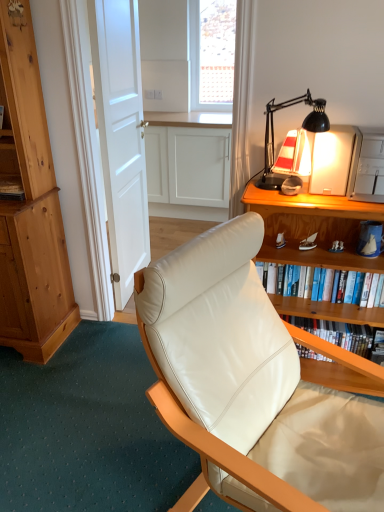
Question: Is white matte door at center completely or partially outside of white leather chair at center?

Choices:
 (A) yes
 (B) no

Answer: (A)

Question: Are white matte door at center and white leather chair at center far apart?

Choices:
 (A) no
 (B) yes

Answer: (B)

Question: Does white matte door at center come in front of white leather chair at center?

Choices:
 (A) no
 (B) yes

Answer: (A)

Question: Is the position of white matte door at center more distant than that of white leather chair at center?

Choices:
 (A) no
 (B) yes

Answer: (B)

Question: Can you confirm if white matte door at center is smaller than white leather chair at center?

Choices:
 (A) no
 (B) yes

Answer: (B)

Question: Does white matte door at center have a greater width compared to white leather chair at center?

Choices:
 (A) no
 (B) yes

Answer: (A)

Question: Can you confirm if black matte desk lamp at upper right is bigger than white mesh screen at upper center?

Choices:
 (A) yes
 (B) no

Answer: (B)

Question: Is black matte desk lamp at upper right oriented away from white mesh screen at upper center?

Choices:
 (A) yes
 (B) no

Answer: (A)

Question: Does black matte desk lamp at upper right turn towards white mesh screen at upper center?

Choices:
 (A) no
 (B) yes

Answer: (A)

Question: Is black matte desk lamp at upper right further to the viewer compared to white mesh screen at upper center?

Choices:
 (A) no
 (B) yes

Answer: (A)

Question: Is black matte desk lamp at upper right with white mesh screen at upper center?

Choices:
 (A) yes
 (B) no

Answer: (B)

Question: Is black matte desk lamp at upper right not near white mesh screen at upper center?

Choices:
 (A) yes
 (B) no

Answer: (A)

Question: Is hardcover book at right, the 1th book positioned from the top, positioned beyond the bounds of white leather chair at center?

Choices:
 (A) no
 (B) yes

Answer: (B)